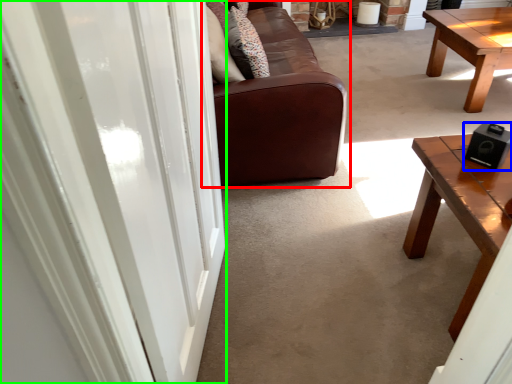
Question: Which is nearer to the studio couch (highlighted by a red box)? speaker (highlighted by a blue box) or screen door (highlighted by a green box).

Choices:
 (A) speaker
 (B) screen door

Answer: (A)